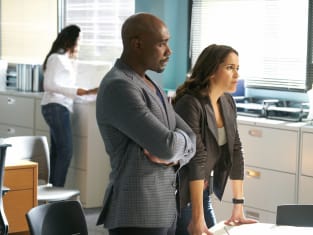
The image size is (313, 235). I want to click on gray flooring, so click(92, 217).